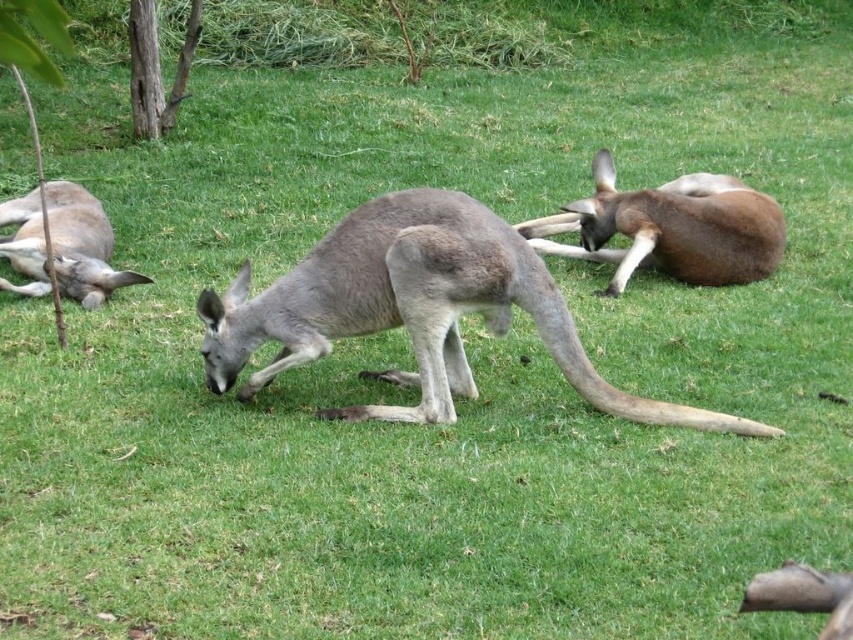
You are a wildlife photographer aiming to capture a photo of both the gray fur kangaroo at center and the brown fur kangaroo at center. Since you want to ensure both kangaroos are clearly visible in the frame, which kangaroo should you focus on first to ensure proper focus, considering their sizes?

The gray fur kangaroo at center is bigger than the brown fur kangaroo at center, so focusing on the gray fur kangaroo at center first would ensure proper focus as it occupies more space in the frame.

You are a photographer trying to capture a photo of the gray fur kangaroo at center and the gray fur kangaroo at left. Which kangaroo should you focus on first if you want to take a photo that includes both in the frame without moving your camera position?

You should focus on the gray fur kangaroo at left first because it is above the gray fur kangaroo at center, so adjusting the camera angle to include both would require framing from the higher position downward.

You are a wildlife photographer trying to capture a photo of the gray fur kangaroo at center and the gray fur kangaroo at left. Your camera can focus on objects within a 5 feet range. Can you fit both kangaroos in the frame without moving your camera?

The distance between the gray fur kangaroo at center and the gray fur kangaroo at left is 5.82 feet, which is beyond the 5 feet focus range of your camera. Therefore, you cannot fit both kangaroos in the frame without moving the camera.